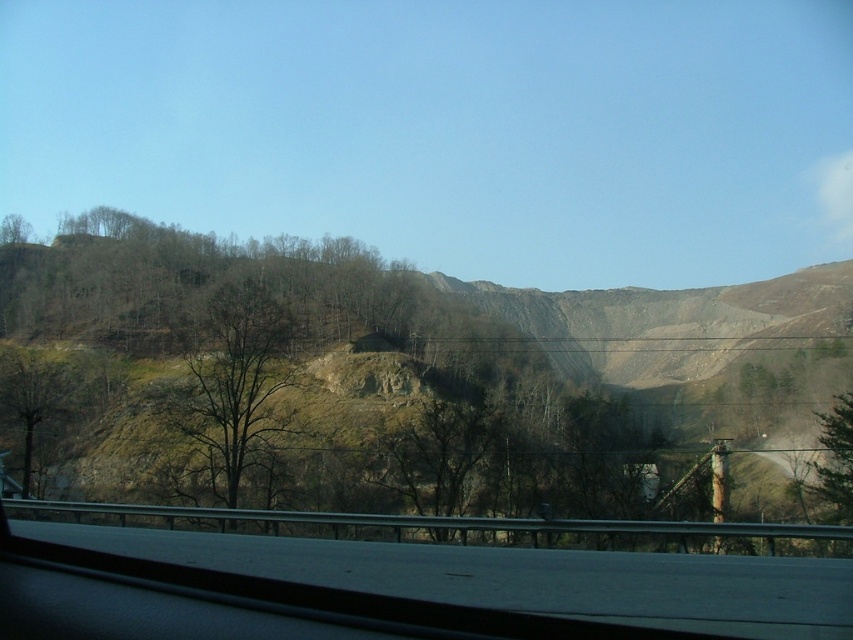
You are a passenger in a car and see the green leafy tree at lower left and the green leafy tree at upper left through the window. Which tree is closer to the car?

The green leafy tree at lower left is closer to the car because it is in front of the green leafy tree at upper left.

You are a passenger in the vehicle and want to know which of the two points, point [204,400] or point [39,406], is nearer to you. Based on the scene, can you determine which point is closer?

Point [204,400] is closer to the camera than point [39,406], so it is nearer to you.